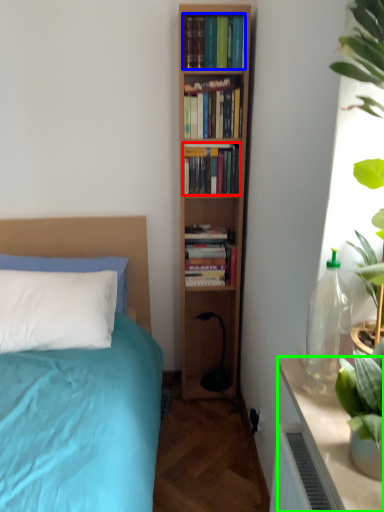
Question: Which object is the closest to the book (highlighted by a red box)? Choose among these: book (highlighted by a blue box) or table (highlighted by a green box).

Choices:
 (A) book
 (B) table

Answer: (A)